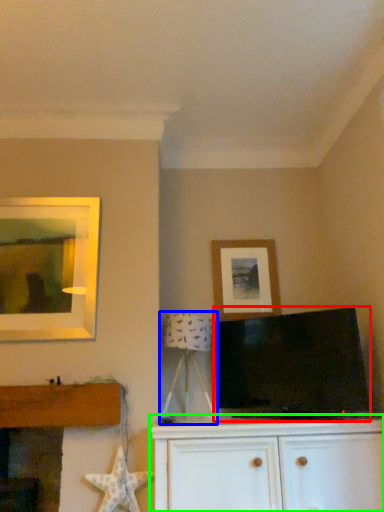
Question: Considering the real-world distances, which object is closest to television (highlighted by a red box)? table lamp (highlighted by a blue box) or cabinetry (highlighted by a green box).

Choices:
 (A) table lamp
 (B) cabinetry

Answer: (B)